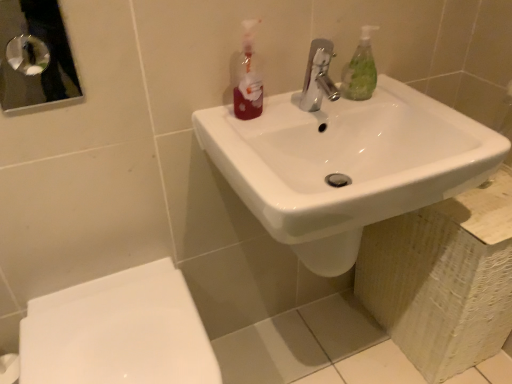
Question: Would you consider polished chrome faucet at center to be distant from green translucent soap dispenser at upper right?

Choices:
 (A) no
 (B) yes

Answer: (A)

Question: Is polished chrome faucet at center aimed at green translucent soap dispenser at upper right?

Choices:
 (A) no
 (B) yes

Answer: (A)

Question: From the image's perspective, is polished chrome faucet at center above green translucent soap dispenser at upper right?

Choices:
 (A) no
 (B) yes

Answer: (A)

Question: Does polished chrome faucet at center appear on the right side of green translucent soap dispenser at upper right?

Choices:
 (A) no
 (B) yes

Answer: (A)

Question: Can you confirm if polished chrome faucet at center is wider than green translucent soap dispenser at upper right?

Choices:
 (A) no
 (B) yes

Answer: (B)

Question: Is the position of polished chrome faucet at center less distant than that of green translucent soap dispenser at upper right?

Choices:
 (A) yes
 (B) no

Answer: (A)

Question: From a real-world perspective, is translucent plastic bottle at upper center positioned under green translucent soap dispenser at upper right based on gravity?

Choices:
 (A) yes
 (B) no

Answer: (B)

Question: Is translucent plastic bottle at upper center wider than green translucent soap dispenser at upper right?

Choices:
 (A) no
 (B) yes

Answer: (A)

Question: Is translucent plastic bottle at upper center oriented away from green translucent soap dispenser at upper right?

Choices:
 (A) no
 (B) yes

Answer: (A)

Question: Considering the relative positions of translucent plastic bottle at upper center and green translucent soap dispenser at upper right in the image provided, is translucent plastic bottle at upper center to the left of green translucent soap dispenser at upper right from the viewer's perspective?

Choices:
 (A) yes
 (B) no

Answer: (A)

Question: Does translucent plastic bottle at upper center have a larger size compared to green translucent soap dispenser at upper right?

Choices:
 (A) yes
 (B) no

Answer: (A)

Question: Can you confirm if translucent plastic bottle at upper center is shorter than green translucent soap dispenser at upper right?

Choices:
 (A) yes
 (B) no

Answer: (B)

Question: From the image's perspective, would you say green translucent soap dispenser at upper right is positioned over polished chrome faucet at center?

Choices:
 (A) no
 (B) yes

Answer: (B)